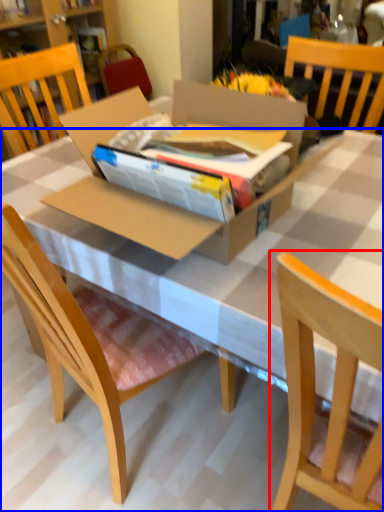
Question: Which object is further to the camera taking this photo, chair (highlighted by a red box) or desk (highlighted by a blue box)?

Choices:
 (A) chair
 (B) desk

Answer: (B)